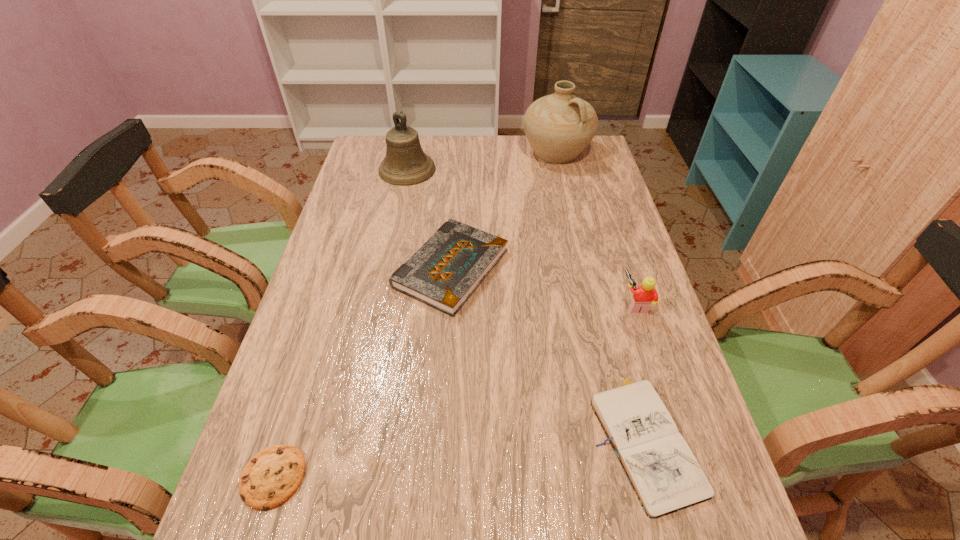
Identify the location of pottery. (559, 126).

The image size is (960, 540). Find the location of `the second tallest object`. the second tallest object is located at coordinates (405, 163).

Locate an element on the screen. Image resolution: width=960 pixels, height=540 pixels. Lego is located at coordinates (645, 294).

This screenshot has width=960, height=540. I want to click on the left notebook, so click(448, 268).

You are a GUI agent. You are given a task and a screenshot of the screen. Output one action in this format:
    pyautogui.click(x=<x>, y=<y>)
    Task: Click on the farther notebook
    The width and height of the screenshot is (960, 540).
    Given the screenshot: What is the action you would take?
    pyautogui.click(x=448, y=268)

This screenshot has height=540, width=960. What are the coordinates of `the shorter notebook` in the screenshot? It's located at (664, 473).

Identify the location of the nearer notebook. The image size is (960, 540). (664, 473).

Identify the location of the shortest object. The height and width of the screenshot is (540, 960). (x=272, y=476).

The height and width of the screenshot is (540, 960). Find the location of `free region located 0.340m on the left of the pottery`. free region located 0.340m on the left of the pottery is located at coordinates (429, 152).

Locate an element on the screen. This screenshot has height=540, width=960. vacant point located on the front of the bell is located at coordinates (395, 230).